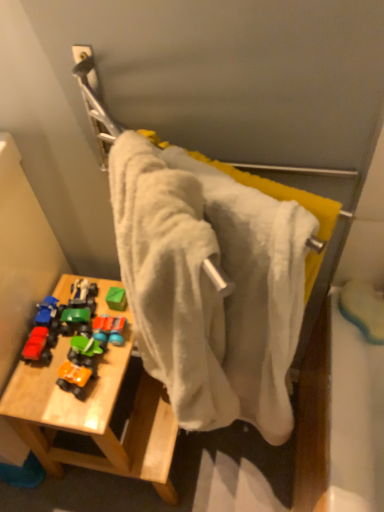
Question: Should I look upward or downward to see wooden table at lower left?

Choices:
 (A) down
 (B) up

Answer: (A)

Question: Considering the relative sizes of matte red toy car at left, which appears as the 4th toy when viewed from the right, and orange matte toy car at lower left, which is counted as the third toy, starting from the left, in the image provided, is matte red toy car at left, which appears as the 4th toy when viewed from the right, wider than orange matte toy car at lower left, which is counted as the third toy, starting from the left,?

Choices:
 (A) yes
 (B) no

Answer: (A)

Question: From the image's perspective, is matte red toy car at left, the first toy in the left-to-right sequence, over orange matte toy car at lower left, which appears as the 2th toy when viewed from the right?

Choices:
 (A) no
 (B) yes

Answer: (B)

Question: Is the surface of matte red toy car at left, the first toy in the left-to-right sequence, in direct contact with orange matte toy car at lower left, which appears as the 2th toy when viewed from the right?

Choices:
 (A) no
 (B) yes

Answer: (B)

Question: Considering the relative sizes of matte red toy car at left, which appears as the 4th toy when viewed from the right, and orange matte toy car at lower left, which is counted as the third toy, starting from the left, in the image provided, is matte red toy car at left, which appears as the 4th toy when viewed from the right, taller than orange matte toy car at lower left, which is counted as the third toy, starting from the left,?

Choices:
 (A) yes
 (B) no

Answer: (B)

Question: Would you say matte red toy car at left, the first toy in the left-to-right sequence, is a long distance from orange matte toy car at lower left, which is counted as the third toy, starting from the left?

Choices:
 (A) yes
 (B) no

Answer: (B)

Question: Considering the relative sizes of matte red toy car at left, which appears as the 4th toy when viewed from the right, and orange matte toy car at lower left, which is counted as the third toy, starting from the left, in the image provided, is matte red toy car at left, which appears as the 4th toy when viewed from the right, shorter than orange matte toy car at lower left, which is counted as the third toy, starting from the left,?

Choices:
 (A) no
 (B) yes

Answer: (B)

Question: From a real-world perspective, is white fabric towel at center physically above wooden table at lower left?

Choices:
 (A) no
 (B) yes

Answer: (B)

Question: From the image's perspective, is white fabric towel at center located above wooden table at lower left?

Choices:
 (A) no
 (B) yes

Answer: (B)

Question: Is white fabric towel at center taller than wooden table at lower left?

Choices:
 (A) no
 (B) yes

Answer: (B)

Question: Is white fabric towel at center thinner than wooden table at lower left?

Choices:
 (A) yes
 (B) no

Answer: (A)

Question: Considering the relative sizes of white fabric towel at center and wooden table at lower left in the image provided, is white fabric towel at center shorter than wooden table at lower left?

Choices:
 (A) no
 (B) yes

Answer: (A)

Question: Is white fabric towel at center oriented towards wooden table at lower left?

Choices:
 (A) yes
 (B) no

Answer: (A)

Question: Does orange matte toy car at lower left, which is counted as the third toy, starting from the left, appear on the right side of wooden table at lower left?

Choices:
 (A) yes
 (B) no

Answer: (B)